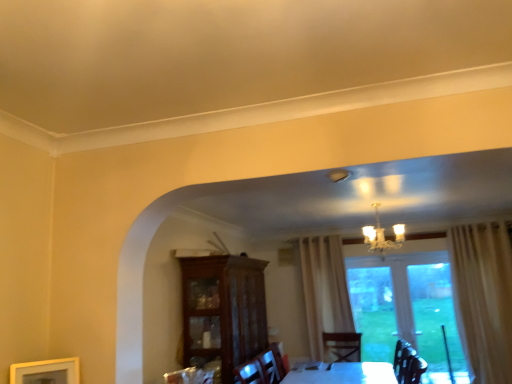
Image resolution: width=512 pixels, height=384 pixels. What do you see at coordinates (406, 308) in the screenshot? I see `transparent glass door at center` at bounding box center [406, 308].

The width and height of the screenshot is (512, 384). Describe the element at coordinates (46, 371) in the screenshot. I see `wooden picture frame at lower left` at that location.

The height and width of the screenshot is (384, 512). Identify the location of transparent glass door at center. (406, 308).

Is wooden picture frame at lower left next to transparent glass door at center and touching it?

No, wooden picture frame at lower left is not touching transparent glass door at center.

Does point (59, 374) lie behind point (356, 258)?

That is False.

Is wooden picture frame at lower left positioned with its back to transparent glass door at center?

No, wooden picture frame at lower left's orientation is not away from transparent glass door at center.

Between wooden picture frame at lower left and transparent glass door at center, which one has less height?

Standing shorter between the two is wooden picture frame at lower left.

What's the angular difference between transparent glass door at center and mahogany glass-front cabinet at center's facing directions?

91.8 degrees separate the facing orientations of transparent glass door at center and mahogany glass-front cabinet at center.

Would you say transparent glass door at center is a long distance from mahogany glass-front cabinet at center?

Yes, transparent glass door at center and mahogany glass-front cabinet at center are located far from each other.

From the image's perspective, which one is positioned higher, transparent glass door at center or mahogany glass-front cabinet at center?

mahogany glass-front cabinet at center appears higher in the image.

Where is `window beneath the mahogany glass-front cabinet at center (from a real-world perspective)`? The image size is (512, 384). window beneath the mahogany glass-front cabinet at center (from a real-world perspective) is located at coordinates (406, 308).

Find the location of `cabinetry to the right of wooden picture frame at lower left`. cabinetry to the right of wooden picture frame at lower left is located at coordinates 223,311.

Is mahogany glass-front cabinet at center facing away from wooden picture frame at lower left?

No, mahogany glass-front cabinet at center's orientation is not away from wooden picture frame at lower left.

Do you think mahogany glass-front cabinet at center is within wooden picture frame at lower left, or outside of it?

mahogany glass-front cabinet at center cannot be found inside wooden picture frame at lower left.

From the image's perspective, is mahogany glass-front cabinet at center under wooden picture frame at lower left?

Yes, from the image's perspective, mahogany glass-front cabinet at center is below wooden picture frame at lower left.

How different are the orientations of mahogany glass-front cabinet at center and gold metallic chandelier at upper center in degrees?

89.6 degrees separate the facing orientations of mahogany glass-front cabinet at center and gold metallic chandelier at upper center.

Does mahogany glass-front cabinet at center contain gold metallic chandelier at upper center?

No, gold metallic chandelier at upper center is not inside mahogany glass-front cabinet at center.

Considering the relative sizes of mahogany glass-front cabinet at center and gold metallic chandelier at upper center in the image provided, is mahogany glass-front cabinet at center wider than gold metallic chandelier at upper center?

Yes, mahogany glass-front cabinet at center is wider than gold metallic chandelier at upper center.

Which of these two, mahogany glass-front cabinet at center or gold metallic chandelier at upper center, stands taller?

Standing taller between the two is mahogany glass-front cabinet at center.

How distant is transparent glass door at center from wooden picture frame at lower left?

transparent glass door at center and wooden picture frame at lower left are 4.94 meters apart from each other.

Is transparent glass door at center looking in the opposite direction of wooden picture frame at lower left?

transparent glass door at center is not turned away from wooden picture frame at lower left.

How different are the orientations of transparent glass door at center and wooden picture frame at lower left in degrees?

52.5 degrees.

In terms of height, does transparent glass door at center look taller or shorter compared to wooden picture frame at lower left?

In the image, transparent glass door at center appears to be taller than wooden picture frame at lower left.

This screenshot has width=512, height=384. I want to click on picture frame lying in front of the gold metallic chandelier at upper center, so click(46, 371).

From the image's perspective, is gold metallic chandelier at upper center located above or below wooden picture frame at lower left?

From the image's perspective, gold metallic chandelier at upper center appears above wooden picture frame at lower left.

Measure the distance between gold metallic chandelier at upper center and wooden picture frame at lower left.

gold metallic chandelier at upper center is 4.24 meters from wooden picture frame at lower left.

Could you tell me if gold metallic chandelier at upper center is turned towards wooden picture frame at lower left?

No, gold metallic chandelier at upper center is not oriented towards wooden picture frame at lower left.

Which is correct: wooden picture frame at lower left is inside gold metallic chandelier at upper center, or outside of it?

wooden picture frame at lower left cannot be found inside gold metallic chandelier at upper center.

Considering the sizes of wooden picture frame at lower left and gold metallic chandelier at upper center in the image, is wooden picture frame at lower left wider or thinner than gold metallic chandelier at upper center?

Clearly, wooden picture frame at lower left has less width compared to gold metallic chandelier at upper center.

From the image's perspective, between wooden picture frame at lower left and gold metallic chandelier at upper center, which one is located above?

gold metallic chandelier at upper center.

Is wooden picture frame at lower left facing away from gold metallic chandelier at upper center?

No, gold metallic chandelier at upper center is not at the back of wooden picture frame at lower left.

Locate an element on the screen. This screenshot has width=512, height=384. window behind the wooden picture frame at lower left is located at coordinates (406, 308).

Locate an element on the screen. cabinetry that appears in front of the transparent glass door at center is located at coordinates (223, 311).

Which object lies further to the anchor point mahogany glass-front cabinet at center, wooden picture frame at lower left or transparent glass door at center?

transparent glass door at center lies further to mahogany glass-front cabinet at center than the other object.

Looking at the image, which one is located closer to gold metallic chandelier at upper center, mahogany glass-front cabinet at center or transparent glass door at center?

transparent glass door at center lies closer to gold metallic chandelier at upper center than the other object.

From the image, which object appears to be farther from mahogany glass-front cabinet at center, transparent glass door at center or wooden picture frame at lower left?

transparent glass door at center lies further to mahogany glass-front cabinet at center than the other object.

Based on their spatial positions, is gold metallic chandelier at upper center or transparent glass door at center further from wooden picture frame at lower left?

Based on the image, transparent glass door at center appears to be further to wooden picture frame at lower left.

When comparing their distances from wooden picture frame at lower left, does mahogany glass-front cabinet at center or gold metallic chandelier at upper center seem further?

gold metallic chandelier at upper center.

Looking at the image, which one is located further to transparent glass door at center, gold metallic chandelier at upper center or mahogany glass-front cabinet at center?

Among the two, mahogany glass-front cabinet at center is located further to transparent glass door at center.

Based on their spatial positions, is mahogany glass-front cabinet at center or wooden picture frame at lower left closer to transparent glass door at center?

mahogany glass-front cabinet at center lies closer to transparent glass door at center than the other object.

Looking at the image, which one is located closer to mahogany glass-front cabinet at center, gold metallic chandelier at upper center or transparent glass door at center?

Based on the image, gold metallic chandelier at upper center appears to be nearer to mahogany glass-front cabinet at center.

Identify the location of cabinetry between wooden picture frame at lower left and gold metallic chandelier at upper center in the horizontal direction. (223, 311).

The width and height of the screenshot is (512, 384). Identify the location of light fixture between wooden picture frame at lower left and transparent glass door at center. (382, 236).

You are a GUI agent. You are given a task and a screenshot of the screen. Output one action in this format:
    pyautogui.click(x=<x>, y=<y>)
    Task: Click on the light fixture between mahogany glass-front cabinet at center and transparent glass door at center from left to right
    The width and height of the screenshot is (512, 384).
    Given the screenshot: What is the action you would take?
    pyautogui.click(x=382, y=236)

What are the coordinates of `cabinetry between wooden picture frame at lower left and transparent glass door at center along the z-axis` in the screenshot? It's located at (223, 311).